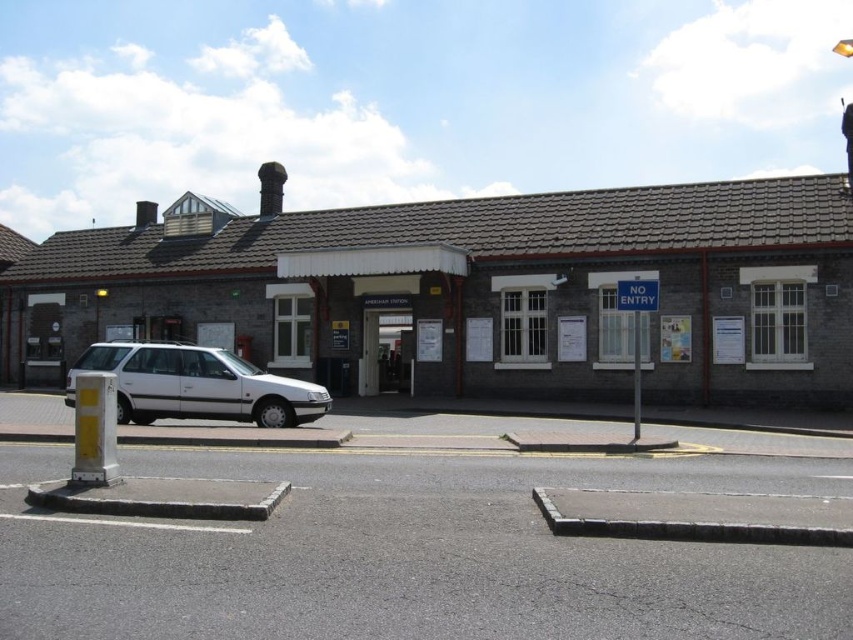
Is white matte car at center above blue plastic sign at center?

Actually, white matte car at center is below blue plastic sign at center.

This screenshot has width=853, height=640. Find the location of `white matte car at center`. white matte car at center is located at coordinates (196, 385).